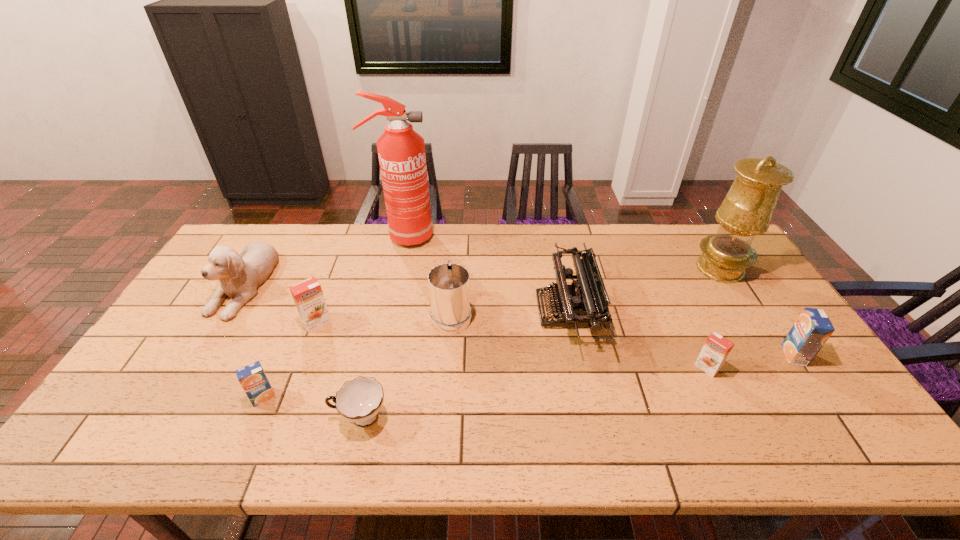
The width and height of the screenshot is (960, 540). Identify the location of vacant region located on the front-facing side of the puppy. (162, 417).

Image resolution: width=960 pixels, height=540 pixels. Identify the location of free space located 0.330m on the side of the sixth object from left to right with the handle. (457, 232).

The width and height of the screenshot is (960, 540). Find the location of `vacant space located 0.320m on the side of the sixth object from left to right with the handle`. vacant space located 0.320m on the side of the sixth object from left to right with the handle is located at coordinates (457, 233).

You are a GUI agent. You are given a task and a screenshot of the screen. Output one action in this format:
    pyautogui.click(x=<x>, y=<y>)
    Task: Click on the free space located on the side of the sixth object from left to right with the handle
    The width and height of the screenshot is (960, 540).
    Given the screenshot: What is the action you would take?
    pyautogui.click(x=457, y=237)

Find the location of a particular element. The height and width of the screenshot is (540, 960). free space located 0.340m on the front of the farthest orange_juice is located at coordinates (271, 444).

The width and height of the screenshot is (960, 540). Find the location of `vacant space located on the back of the bigger blue orange_juice`. vacant space located on the back of the bigger blue orange_juice is located at coordinates (757, 301).

This screenshot has height=540, width=960. I want to click on vacant region located 0.390m on the typing side of the seventh object from left to right, so click(x=408, y=310).

The height and width of the screenshot is (540, 960). Find the location of `vacant space situated on the typing side of the seventh object from left to right`. vacant space situated on the typing side of the seventh object from left to right is located at coordinates (497, 310).

Identify the location of free point located on the typing side of the seventh object from left to right. Image resolution: width=960 pixels, height=540 pixels. (478, 310).

Locate an element on the screen. This screenshot has width=960, height=540. vacant region located 0.260m on the back of the smaller orange orange juice is located at coordinates (671, 293).